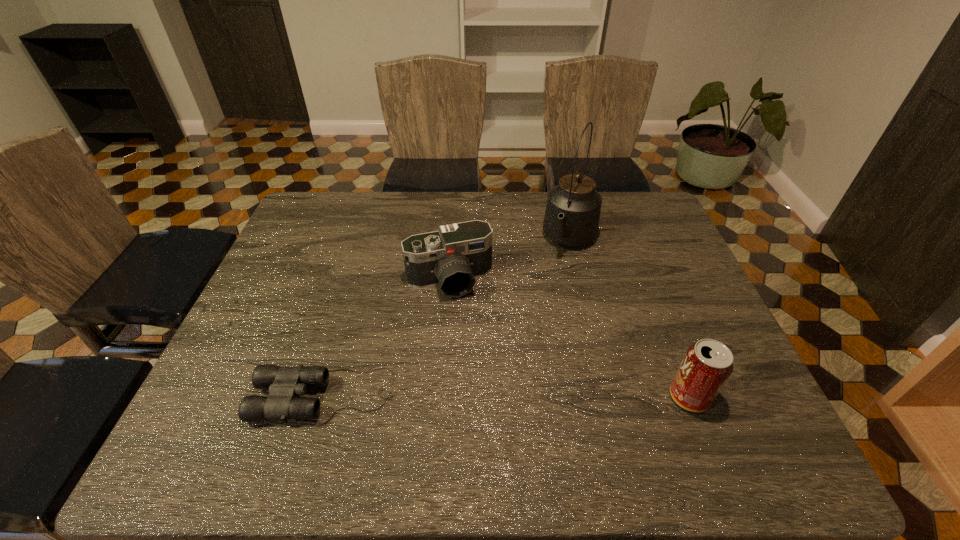
Where is `empty location between the soda can and the camera`? empty location between the soda can and the camera is located at coordinates (569, 339).

Find the location of `empty location between the camera and the shortest object`. empty location between the camera and the shortest object is located at coordinates (387, 338).

You are a GUI agent. You are given a task and a screenshot of the screen. Output one action in this format:
    pyautogui.click(x=<x>, y=<y>)
    Task: Click on the blank region between the binoculars and the camera
    
    Given the screenshot: What is the action you would take?
    pyautogui.click(x=387, y=338)

This screenshot has height=540, width=960. I want to click on vacant area that lies between the binoculars and the tallest object, so click(x=447, y=318).

The image size is (960, 540). I want to click on empty space that is in between the shortest object and the camera, so click(x=387, y=338).

Where is `free space between the soda can and the camera`? free space between the soda can and the camera is located at coordinates (569, 339).

This screenshot has width=960, height=540. Identify the location of object that stands as the second closest to the tallest object. [x=707, y=365].

Identify the location of object identified as the third closest to the binoculars. (707, 365).